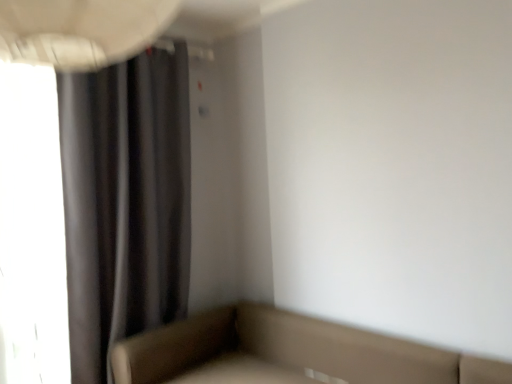
This screenshot has width=512, height=384. What do you see at coordinates (287, 353) in the screenshot?
I see `leather-like beige studio couch at lower right` at bounding box center [287, 353].

What are the coordinates of `leather-like beige studio couch at lower right` in the screenshot? It's located at (287, 353).

In order to face dark matte curtain at left, should I rotate leftwards or rightwards?

To face it directly, rotate left by 17.945 degrees.

Describe the element at coordinates (125, 202) in the screenshot. I see `dark matte curtain at left` at that location.

Locate an element on the screen. dark matte curtain at left is located at coordinates (125, 202).

You are a GUI agent. You are given a task and a screenshot of the screen. Output one action in this format:
    pyautogui.click(x=<x>, y=<y>)
    Task: Click on the leather-like beige studio couch at lower right
    The height and width of the screenshot is (384, 512).
    Given the screenshot: What is the action you would take?
    pyautogui.click(x=287, y=353)

Considering the relative positions of dark matte curtain at left and leather-like beige studio couch at lower right in the image provided, is dark matte curtain at left to the left of leather-like beige studio couch at lower right from the viewer's perspective?

Yes, dark matte curtain at left is to the left of leather-like beige studio couch at lower right.

Which object is more forward, dark matte curtain at left or leather-like beige studio couch at lower right?

leather-like beige studio couch at lower right.

Which is closer to the camera, [187,261] or [181,330]?

Point [187,261] is farther from the camera than point [181,330].

From the image's perspective, is dark matte curtain at left below leather-like beige studio couch at lower right?

Incorrect, from the image's perspective, dark matte curtain at left is higher than leather-like beige studio couch at lower right.

From a real-world perspective, does dark matte curtain at left sit lower than leather-like beige studio couch at lower right?

No, from a real-world perspective, dark matte curtain at left is not below leather-like beige studio couch at lower right.

Can you confirm if dark matte curtain at left is thinner than leather-like beige studio couch at lower right?

Yes.

Which of these two, dark matte curtain at left or leather-like beige studio couch at lower right, stands taller?

dark matte curtain at left.

Considering the relative sizes of dark matte curtain at left and leather-like beige studio couch at lower right in the image provided, is dark matte curtain at left smaller than leather-like beige studio couch at lower right?

Indeed, dark matte curtain at left has a smaller size compared to leather-like beige studio couch at lower right.

Is leather-like beige studio couch at lower right surrounded by dark matte curtain at left?

No, leather-like beige studio couch at lower right is located outside of dark matte curtain at left.

Are dark matte curtain at left and leather-like beige studio couch at lower right located far from each other?

No, dark matte curtain at left is not far away from leather-like beige studio couch at lower right.

Is dark matte curtain at left facing away from leather-like beige studio couch at lower right?

No.

How different are the orientations of dark matte curtain at left and leather-like beige studio couch at lower right in degrees?

dark matte curtain at left and leather-like beige studio couch at lower right are facing 90.3 degrees away from each other.

How far apart are dark matte curtain at left and leather-like beige studio couch at lower right?

dark matte curtain at left is 30.29 inches from leather-like beige studio couch at lower right.

The height and width of the screenshot is (384, 512). I want to click on curtain above the leather-like beige studio couch at lower right (from the image's perspective), so click(x=125, y=202).

Between leather-like beige studio couch at lower right and dark matte curtain at left, which one appears on the left side from the viewer's perspective?

dark matte curtain at left.

Between leather-like beige studio couch at lower right and dark matte curtain at left, which one is positioned in front?

leather-like beige studio couch at lower right is more forward.

Is point (362, 358) positioned in front of point (162, 58)?

Yes, it is in front of point (162, 58).

From the image's perspective, which is above, leather-like beige studio couch at lower right or dark matte curtain at left?

dark matte curtain at left is shown above in the image.

From a real-world perspective, is leather-like beige studio couch at lower right below dark matte curtain at left?

Yes.

Which object is thinner, leather-like beige studio couch at lower right or dark matte curtain at left?

With smaller width is dark matte curtain at left.

Does leather-like beige studio couch at lower right have a greater height compared to dark matte curtain at left?

No, leather-like beige studio couch at lower right is not taller than dark matte curtain at left.

Between leather-like beige studio couch at lower right and dark matte curtain at left, which one has smaller size?

Smaller between the two is dark matte curtain at left.

Consider the image. Is leather-like beige studio couch at lower right completely or partially outside of dark matte curtain at left?

Yes, leather-like beige studio couch at lower right is outside of dark matte curtain at left.

Would you say leather-like beige studio couch at lower right is a long distance from dark matte curtain at left?

No, there isn't a large distance between leather-like beige studio couch at lower right and dark matte curtain at left.

Is leather-like beige studio couch at lower right facing towards dark matte curtain at left?

No, leather-like beige studio couch at lower right does not turn towards dark matte curtain at left.

From the picture: How different are the orientations of leather-like beige studio couch at lower right and dark matte curtain at left in degrees?

90.3 degrees.

Where is `curtain above the leather-like beige studio couch at lower right (from the image's perspective)`? This screenshot has width=512, height=384. curtain above the leather-like beige studio couch at lower right (from the image's perspective) is located at coordinates (125, 202).

Locate an element on the screen. curtain that appears behind the leather-like beige studio couch at lower right is located at coordinates (125, 202).

In order to click on curtain on the left of the leather-like beige studio couch at lower right in this screenshot , I will do `click(125, 202)`.